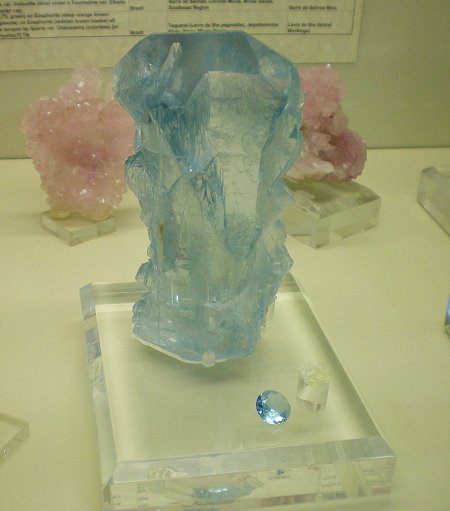
The width and height of the screenshot is (450, 511). In order to click on countertop in this screenshot , I will do `click(377, 313)`.